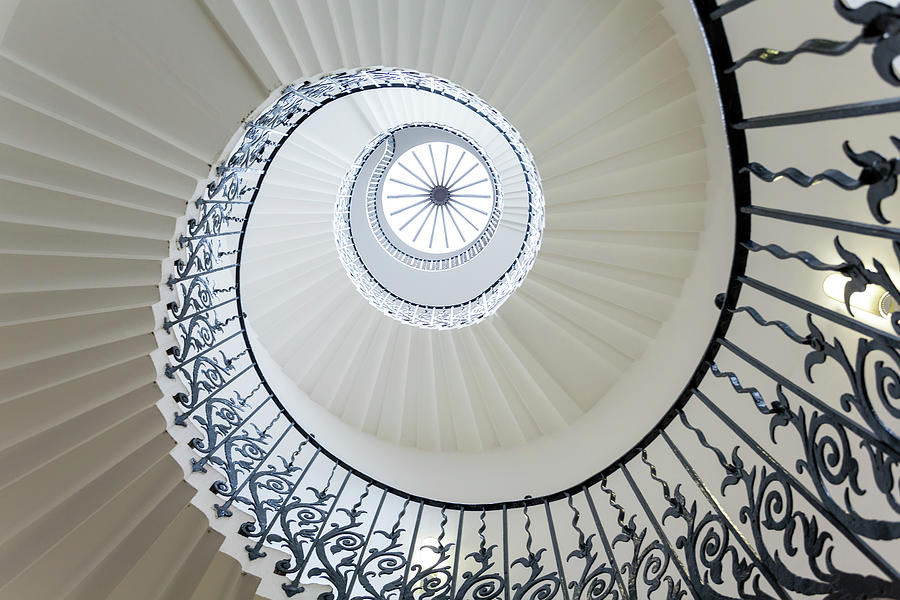
Look for where light bulbs would go in the image and show me where they are. Your answer should be formatted as a list of tuples, i.e. [(x1, y1), (x2, y2), ...], where each tuple contains the x and y coordinates of a point satisfying the conditions above.

[(868, 299), (428, 542), (427, 187)]